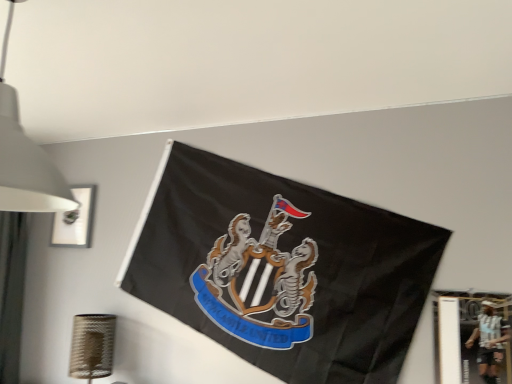
Question: Is metallic silver picture frame at lower right, positioned as the first picture frame in bottom-to-top order, taller than white matte lampshade at upper left?

Choices:
 (A) yes
 (B) no

Answer: (B)

Question: Is metallic silver picture frame at lower right, positioned as the 2th picture frame in back-to-front order, at the right side of white matte lampshade at upper left?

Choices:
 (A) no
 (B) yes

Answer: (B)

Question: From the image's perspective, would you say metallic silver picture frame at lower right, arranged as the second picture frame when viewed from the left, is positioned over white matte lampshade at upper left?

Choices:
 (A) no
 (B) yes

Answer: (A)

Question: Is metallic silver picture frame at lower right, arranged as the second picture frame when viewed from the left, oriented towards white matte lampshade at upper left?

Choices:
 (A) yes
 (B) no

Answer: (B)

Question: Is metallic silver picture frame at lower right, which is the 1th picture frame from front to back, smaller than white matte lampshade at upper left?

Choices:
 (A) no
 (B) yes

Answer: (B)

Question: Is matte white picture frame at upper left, the second picture frame from the front, wider or thinner than white matte lampshade at upper left?

Choices:
 (A) thin
 (B) wide

Answer: (A)

Question: Based on their positions, is matte white picture frame at upper left, which appears as the second picture frame when ordered from the bottom, located to the left or right of white matte lampshade at upper left?

Choices:
 (A) left
 (B) right

Answer: (A)

Question: In the image, is matte white picture frame at upper left, placed as the 1th picture frame when sorted from left to right, positioned in front of or behind white matte lampshade at upper left?

Choices:
 (A) front
 (B) behind

Answer: (B)

Question: Is point (82, 233) positioned closer to the camera than point (15, 196)?

Choices:
 (A) closer
 (B) farther

Answer: (B)

Question: From the image's perspective, is metallic silver picture frame at lower right, arranged as the first picture frame when viewed from the right, above or below matte white picture frame at upper left, the 2th picture frame when ordered from right to left?

Choices:
 (A) above
 (B) below

Answer: (B)

Question: In terms of width, does metallic silver picture frame at lower right, positioned as the first picture frame in bottom-to-top order, look wider or thinner when compared to matte white picture frame at upper left, the second picture frame from the front?

Choices:
 (A) wide
 (B) thin

Answer: (B)

Question: From a real-world perspective, relative to matte white picture frame at upper left, which is the 1th picture frame from back to front, is metallic silver picture frame at lower right, arranged as the first picture frame when viewed from the right, vertically above or below?

Choices:
 (A) below
 (B) above

Answer: (A)

Question: Is metallic silver picture frame at lower right, arranged as the second picture frame when viewed from the left, bigger or smaller than matte white picture frame at upper left, the 2th picture frame when ordered from right to left?

Choices:
 (A) big
 (B) small

Answer: (B)

Question: Considering the positions of point (5, 115) and point (510, 375), is point (5, 115) closer or farther from the camera than point (510, 375)?

Choices:
 (A) farther
 (B) closer

Answer: (B)

Question: Considering the positions of white matte lampshade at upper left and metallic silver picture frame at lower right, arranged as the first picture frame when viewed from the right, in the image, is white matte lampshade at upper left bigger or smaller than metallic silver picture frame at lower right, arranged as the first picture frame when viewed from the right,?

Choices:
 (A) big
 (B) small

Answer: (A)